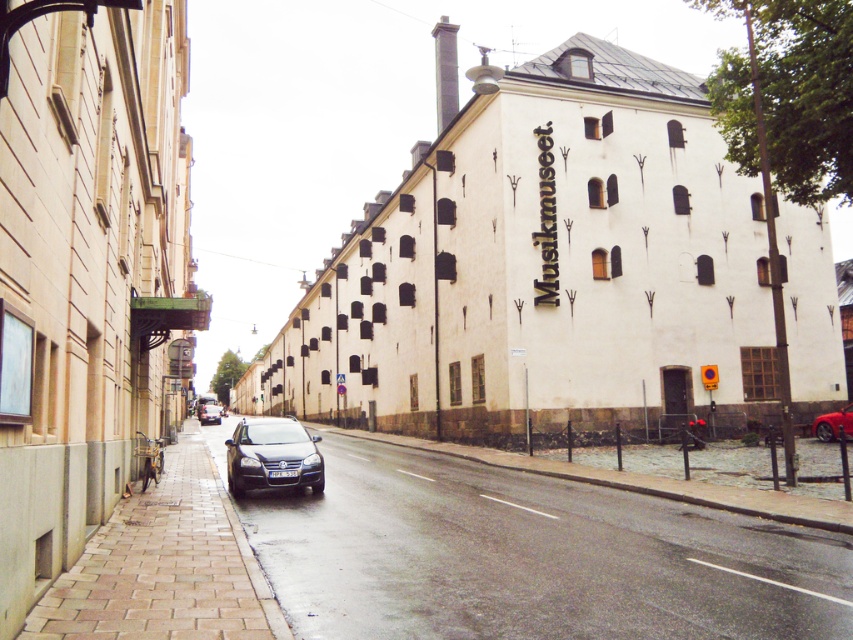
Between brown brick pavement at lower left and shiny black car at center, which one appears on the left side from the viewer's perspective?

brown brick pavement at lower left

Which is more to the right, brown brick pavement at lower left or shiny black car at center?

shiny black car at center is more to the right.

Who is more forward, (277, 636) or (252, 460)?

Point (277, 636) is more forward.

Find the location of a particular element. brown brick pavement at lower left is located at coordinates pos(164,564).

What do you see at coordinates (164, 564) in the screenshot?
I see `brown brick pavement at lower left` at bounding box center [164, 564].

Is point (283, 630) positioned in front of point (201, 422)?

Yes.

You are a GUI agent. You are given a task and a screenshot of the screen. Output one action in this format:
    pyautogui.click(x=<x>, y=<y>)
    Task: Click on the brown brick pavement at lower left
    This screenshot has height=640, width=853.
    Given the screenshot: What is the action you would take?
    pyautogui.click(x=164, y=564)

Who is positioned more to the right, shiny black car at center or shiny black sedan at center?

Positioned to the right is shiny black car at center.

Can you confirm if shiny black car at center is thinner than shiny black sedan at center?

Correct, shiny black car at center's width is less than shiny black sedan at center's.

Does point (316, 440) come closer to viewer compared to point (207, 419)?

Yes.

Locate an element on the screen. The height and width of the screenshot is (640, 853). shiny black car at center is located at coordinates pos(271,456).